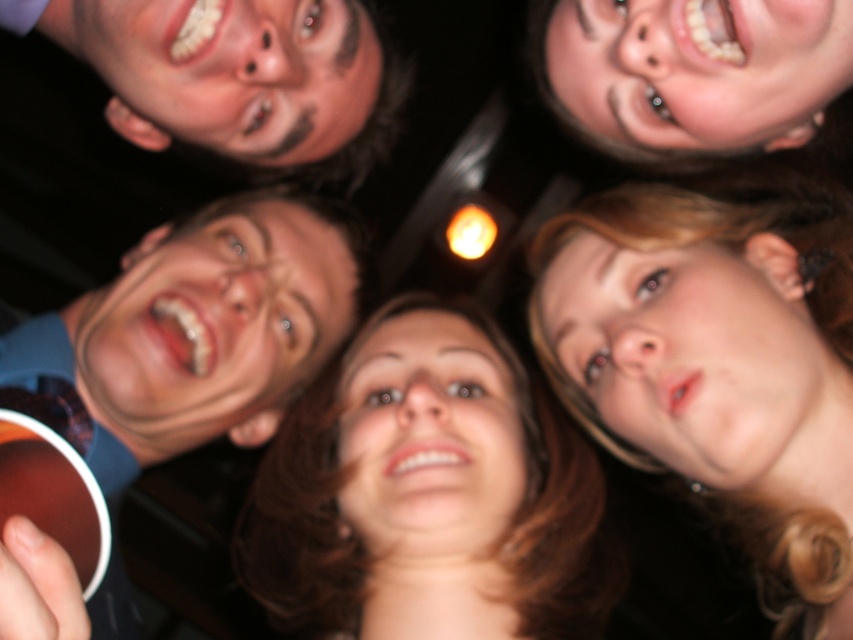
You are a photographer trying to capture a group photo. You notice the blue fabric shirt at upper left and the smooth skin face at upper right. Which object should you adjust your camera focus to ensure both are in focus, considering their size difference?

Since the blue fabric shirt at upper left is bigger than the smooth skin face at upper right, you should focus on the blue fabric shirt at upper left to ensure both are in focus as it is larger and might require more attention.